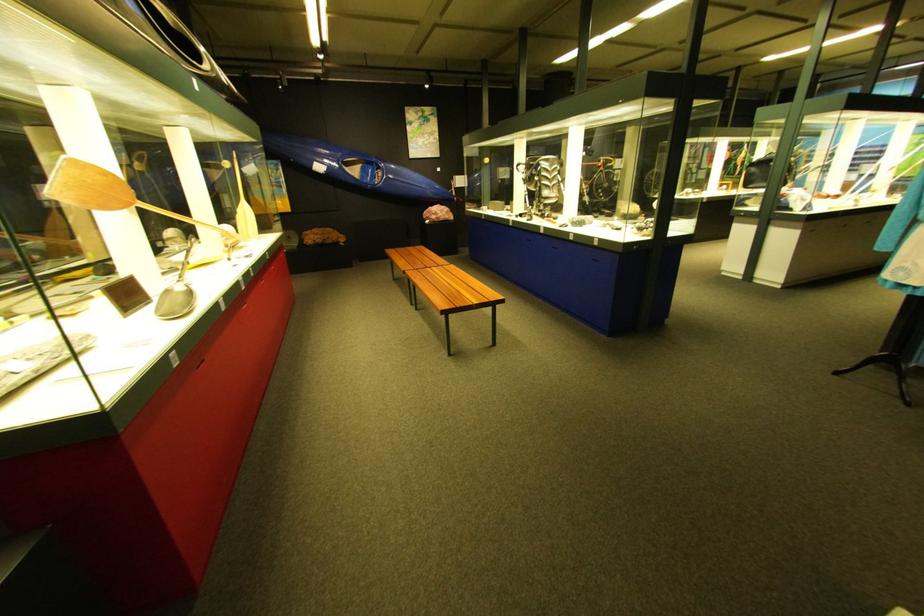
Locate an element on the screen. red cabinet handle is located at coordinates (201, 315).